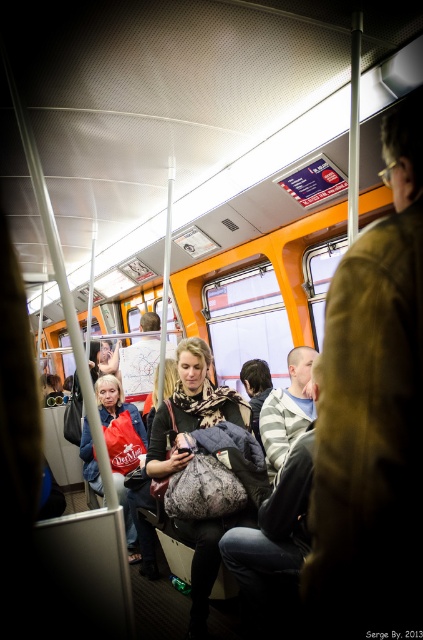
Does leopard print scarf at center appear over matte red bag at center?

Correct, leopard print scarf at center is located above matte red bag at center.

Consider the image. Who is more forward, (194, 381) or (123, 449)?

Point (194, 381) is in front.

Between point (236, 397) and point (134, 452), which one is positioned behind?

Point (134, 452)

This screenshot has width=423, height=640. What are the coordinates of `leopard print scarf at center` in the screenshot? It's located at (192, 406).

Who is positioned more to the right, brown leather jacket at right or matte red bag at center?

From the viewer's perspective, brown leather jacket at right appears more on the right side.

Is point (376, 586) closer to camera compared to point (114, 445)?

Yes, it is.

Where is `brown leather jacket at right`? The height and width of the screenshot is (640, 423). brown leather jacket at right is located at coordinates (373, 416).

In the scene shown: Does brown leather jacket at right have a greater width compared to leopard print scarf at center?

No, brown leather jacket at right is not wider than leopard print scarf at center.

Find the location of a particular element. The image size is (423, 640). brown leather jacket at right is located at coordinates click(x=373, y=416).